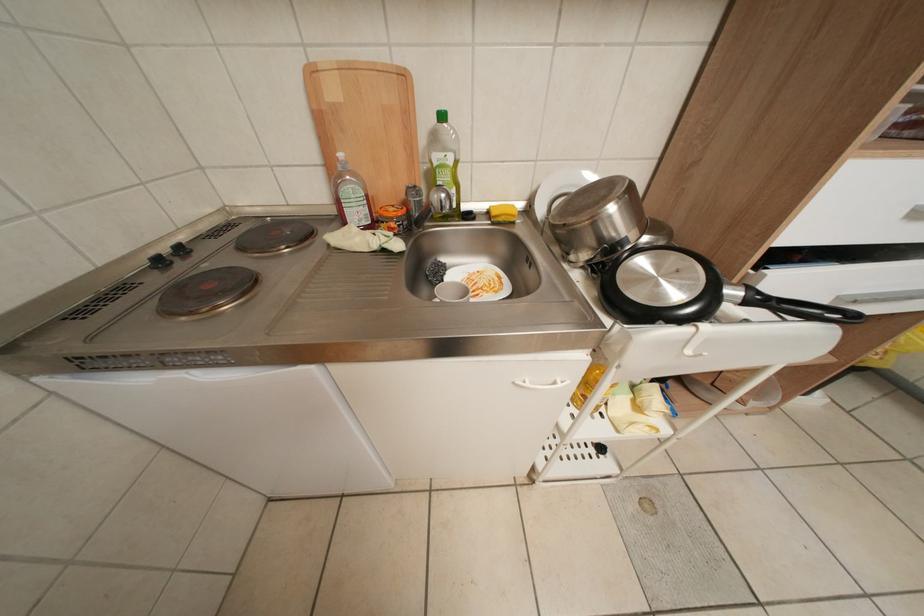
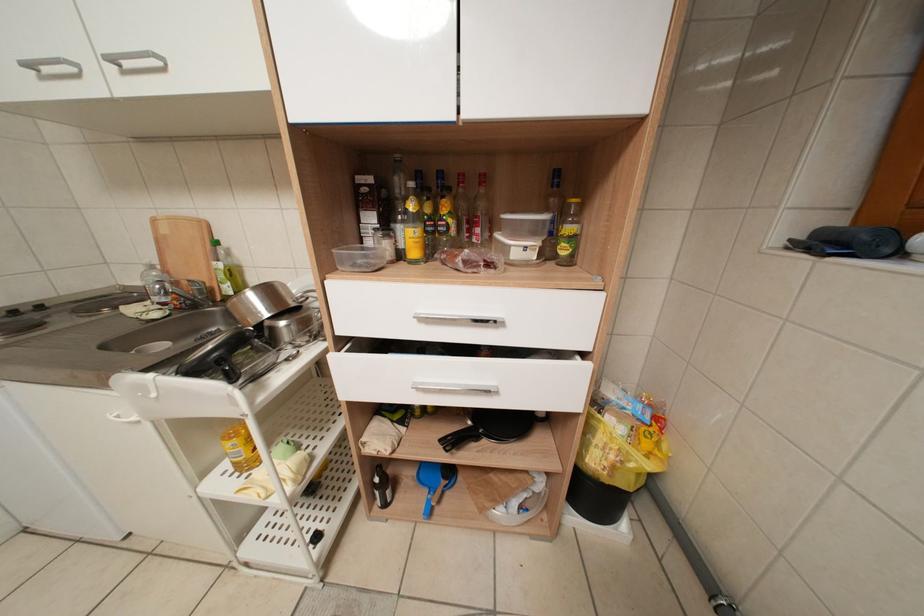
Question: In a continuous first-person perspective shot, in which direction is the camera moving?

Choices:
 (A) Left
 (B) Right
 (C) Forward
 (D) Backward

Answer: (B)